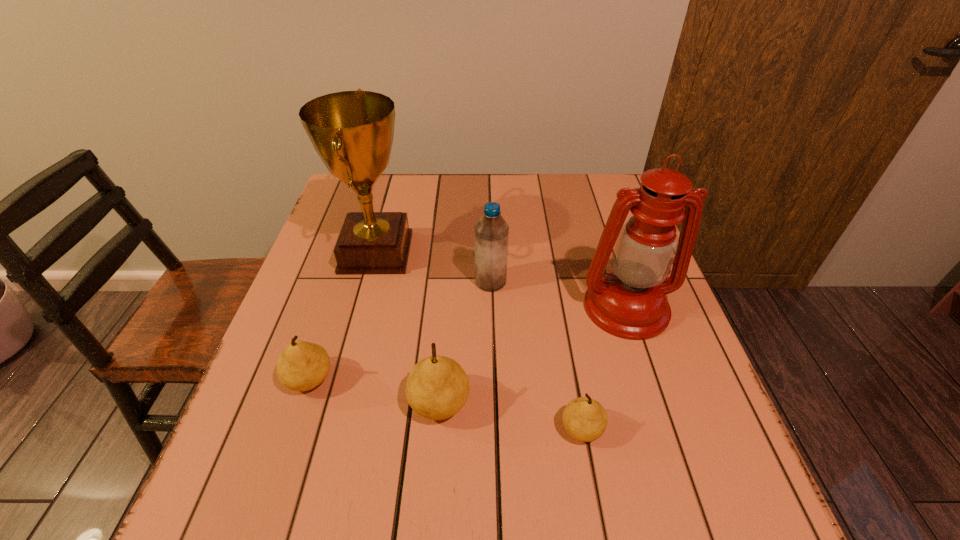
Where is `the leftmost pear`? The image size is (960, 540). the leftmost pear is located at coordinates (302, 366).

Identify the location of the fifth tallest object. Image resolution: width=960 pixels, height=540 pixels. (302, 366).

Identify the location of the fourth object from right to left. The image size is (960, 540). (437, 387).

You are a GUI agent. You are given a task and a screenshot of the screen. Output one action in this format:
    pyautogui.click(x=<x>, y=<y>)
    Task: Click on the second pear from left to right
    The height and width of the screenshot is (540, 960).
    Given the screenshot: What is the action you would take?
    pyautogui.click(x=437, y=387)

What are the coordinates of `the second object from right to left` in the screenshot? It's located at (585, 419).

Where is `the rightmost pear`? The image size is (960, 540). the rightmost pear is located at coordinates (585, 419).

You are a GUI agent. You are given a task and a screenshot of the screen. Output one action in this format:
    pyautogui.click(x=<x>, y=<y>)
    Task: Click on the award
    The height and width of the screenshot is (540, 960).
    Given the screenshot: What is the action you would take?
    pyautogui.click(x=352, y=131)

This screenshot has height=540, width=960. Identify the location of water bottle. (491, 231).

You are a GUI agent. You are given a task and a screenshot of the screen. Output one action in this format:
    pyautogui.click(x=<x>, y=<y>)
    Task: Click on the third tallest object
    This screenshot has height=540, width=960.
    Given the screenshot: What is the action you would take?
    pyautogui.click(x=491, y=231)

Identify the location of the rightmost object. Image resolution: width=960 pixels, height=540 pixels. (630, 302).